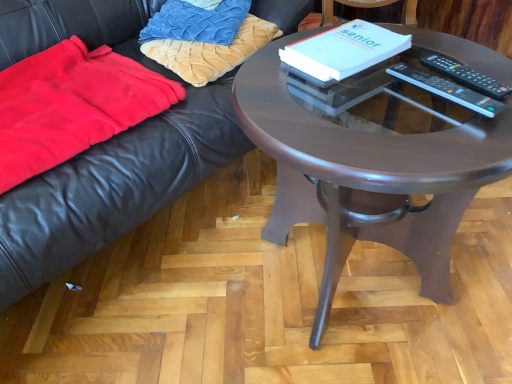
The image size is (512, 384). Identify the location of space that is in front of black plastic remote control at upper right, placed as the 1th remote control when sorted from right to left. (465, 124).